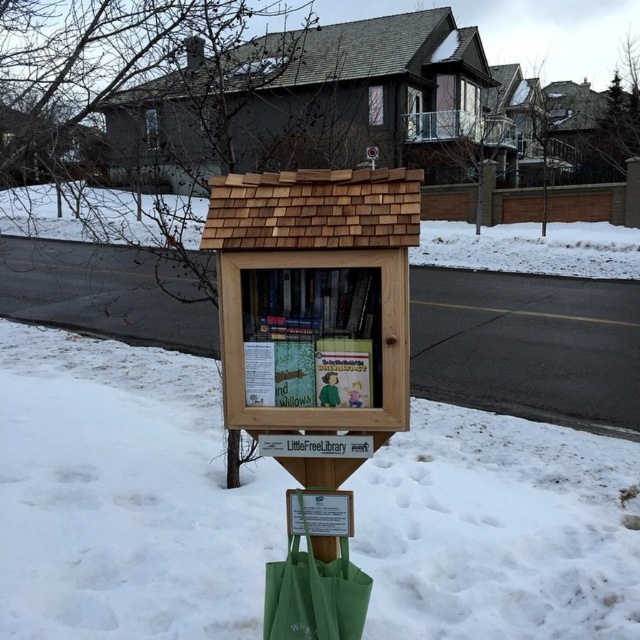
From the picture: You are standing in front of the little free library and want to take a book. The hardcover book at center and the green canvas bag at lower center are both in your line of sight. Which item is closer to you?

The hardcover book at center is closer to the viewer than the green canvas bag at lower center.